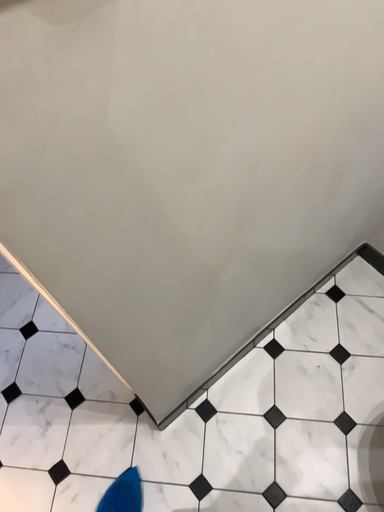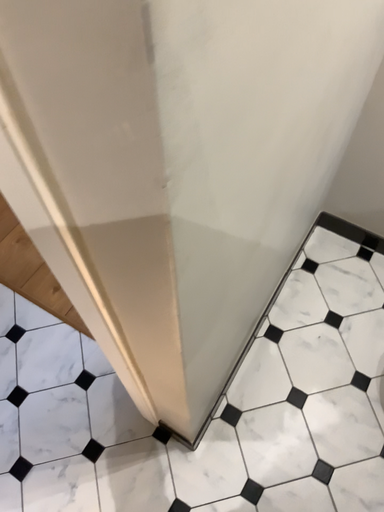
Question: How did the camera likely rotate when shooting the video?

Choices:
 (A) rotated left
 (B) rotated right

Answer: (B)